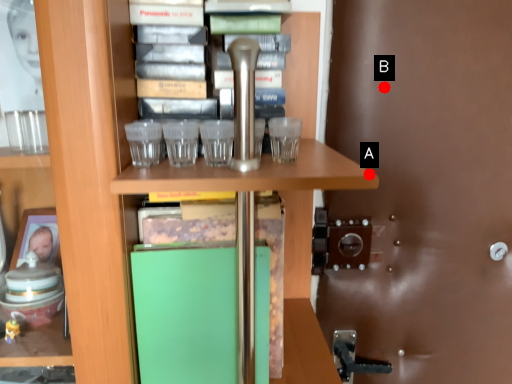
Question: Two points are circled on the image, labeled by A and B beside each circle. Which point is closer to the camera?

Choices:
 (A) A is closer
 (B) B is closer

Answer: (A)